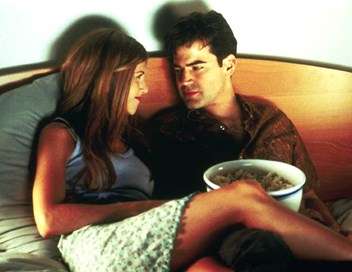
Locate an element on the screen. This screenshot has width=352, height=272. wall is located at coordinates (306, 36).